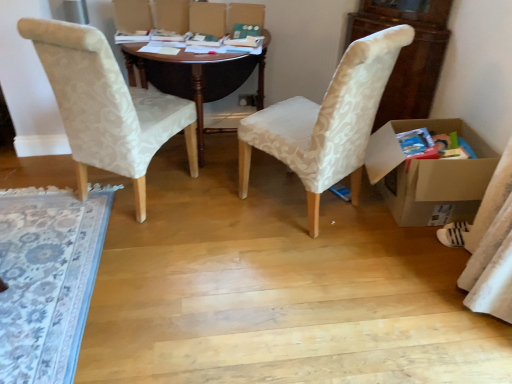
Question: From the image's perspective, is patterned fabric rug at left over dark wood desk at center?

Choices:
 (A) no
 (B) yes

Answer: (A)

Question: Is patterned fabric rug at left beside dark wood desk at center?

Choices:
 (A) no
 (B) yes

Answer: (A)

Question: Is patterned fabric rug at left behind dark wood desk at center?

Choices:
 (A) yes
 (B) no

Answer: (B)

Question: From a real-world perspective, is patterned fabric rug at left positioned under dark wood desk at center based on gravity?

Choices:
 (A) no
 (B) yes

Answer: (B)

Question: Does patterned fabric rug at left have a greater height compared to dark wood desk at center?

Choices:
 (A) yes
 (B) no

Answer: (B)

Question: Does patterned fabric rug at left appear on the left side of dark wood desk at center?

Choices:
 (A) no
 (B) yes

Answer: (B)

Question: Is cardboard box at right beside matte white fabric chair at left, marked as the first chair in a left-to-right arrangement?

Choices:
 (A) yes
 (B) no

Answer: (B)

Question: Can you confirm if cardboard box at right is smaller than matte white fabric chair at left, which is counted as the 2th chair, starting from the right?

Choices:
 (A) no
 (B) yes

Answer: (B)

Question: From a real-world perspective, is cardboard box at right physically above matte white fabric chair at left, which is counted as the 2th chair, starting from the right?

Choices:
 (A) yes
 (B) no

Answer: (B)

Question: Is cardboard box at right oriented towards matte white fabric chair at left, which is counted as the 2th chair, starting from the right?

Choices:
 (A) no
 (B) yes

Answer: (B)

Question: Is cardboard box at right shorter than matte white fabric chair at left, marked as the first chair in a left-to-right arrangement?

Choices:
 (A) yes
 (B) no

Answer: (A)

Question: Does cardboard box at right appear on the right side of matte white fabric chair at left, marked as the first chair in a left-to-right arrangement?

Choices:
 (A) yes
 (B) no

Answer: (A)

Question: Does white fabric sock at lower right have a greater width compared to matte beige fabric chair at center, marked as the second chair in a left-to-right arrangement?

Choices:
 (A) yes
 (B) no

Answer: (B)